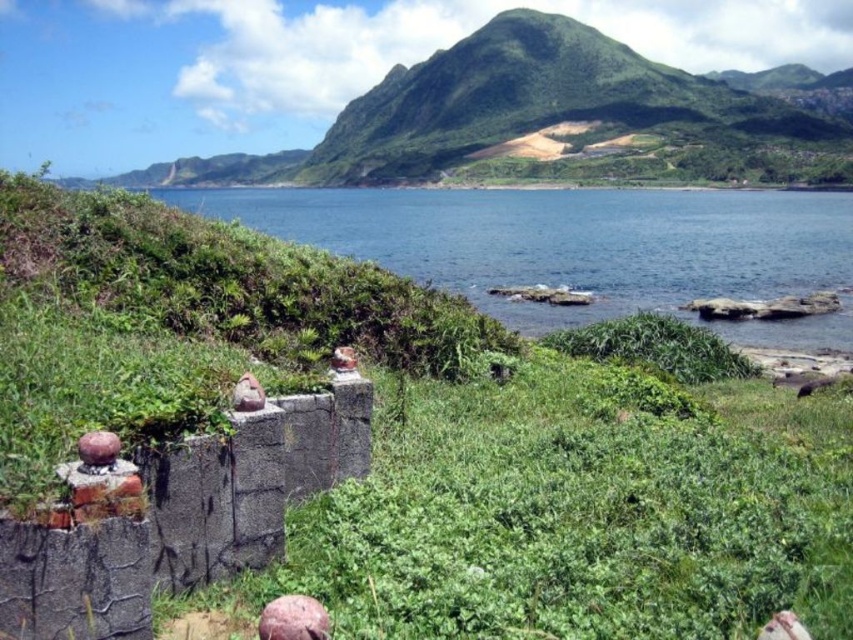
Between green grassy mountain at upper center and blue water at center, which one is positioned higher?

green grassy mountain at upper center

Identify the location of green grassy mountain at upper center. This screenshot has height=640, width=853. (556, 118).